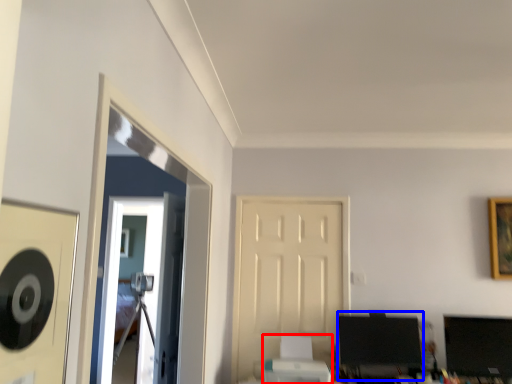
Question: Which object is closer to the camera taking this photo, printer (highlighted by a red box) or computer monitor (highlighted by a blue box)?

Choices:
 (A) printer
 (B) computer monitor

Answer: (A)